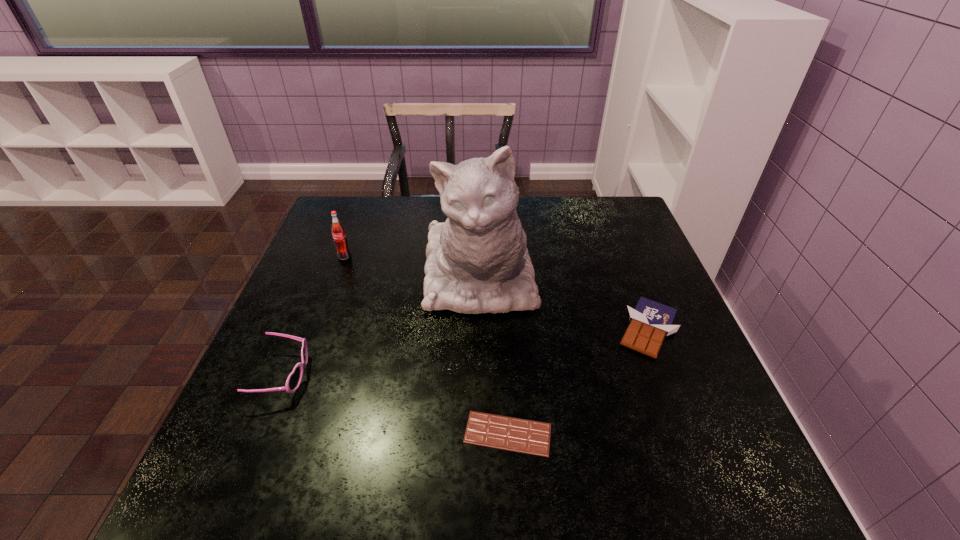
Find the location of a particular element. The width and height of the screenshot is (960, 540). vacant region located on the left of the second shortest object is located at coordinates (489, 329).

Identify the location of vacant space located on the left of the left chocolate bar. The width and height of the screenshot is (960, 540). (345, 434).

This screenshot has width=960, height=540. Identify the location of object that is positioned at the far edge. (477, 261).

Locate an element on the screen. The image size is (960, 540). soda bottle that is at the left edge is located at coordinates (338, 231).

I want to click on sunglasses present at the left edge, so click(x=294, y=379).

In order to click on object positioned at the right edge in this screenshot , I will do `click(650, 321)`.

Locate an element on the screen. The width and height of the screenshot is (960, 540). free space at the far edge is located at coordinates (539, 231).

Find the location of a particular element. This screenshot has height=540, width=960. free spot at the near edge of the desktop is located at coordinates (344, 497).

The image size is (960, 540). In order to click on free spot at the right edge of the desktop in this screenshot , I will do `click(636, 276)`.

Image resolution: width=960 pixels, height=540 pixels. In the image, there is a desktop. What are the coordinates of `free space at the far left corner` in the screenshot? It's located at (351, 233).